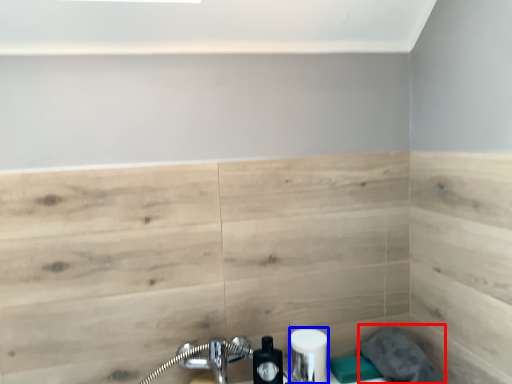
Question: Which object is further to the camera taking this photo, gray (highlighted by a red box) or toiletry (highlighted by a blue box)?

Choices:
 (A) gray
 (B) toiletry

Answer: (B)